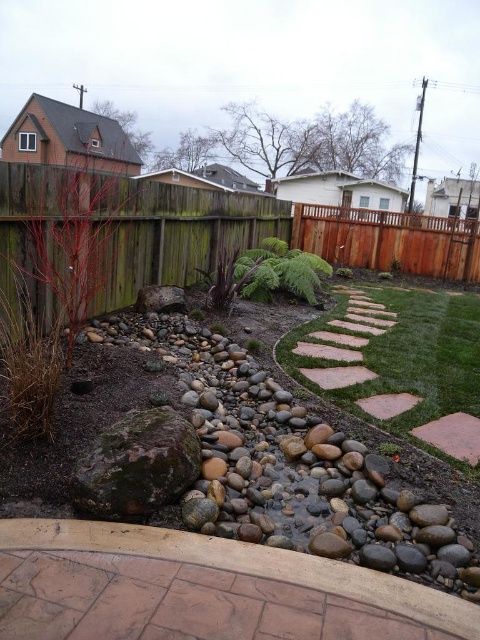
Can you confirm if green wood fence at left is smaller than green grass at center?

Incorrect, green wood fence at left is not smaller in size than green grass at center.

Is point (105, 186) closer to camera compared to point (456, 394)?

No, (105, 186) is further to viewer.

The width and height of the screenshot is (480, 640). Identify the location of green wood fence at left. (118, 234).

Is point (207, 221) closer to camera compared to point (434, 275)?

Yes, point (207, 221) is closer to viewer.

Between green wood fence at left and brown wood fence at upper right, which one appears on the right side from the viewer's perspective?

brown wood fence at upper right

Which is in front, point (244, 241) or point (367, 256)?

Point (244, 241) is in front.

Locate an element on the screen. The height and width of the screenshot is (640, 480). green wood fence at left is located at coordinates (118, 234).

Can you confirm if green grass at center is smaller than brown wood fence at upper right?

Incorrect, green grass at center is not smaller in size than brown wood fence at upper right.

Is green grass at center bigger than brown wood fence at upper right?

Yes, green grass at center is bigger than brown wood fence at upper right.

Describe the element at coordinates (406, 356) in the screenshot. I see `green grass at center` at that location.

This screenshot has height=640, width=480. Find the location of `green grass at center`. green grass at center is located at coordinates (406, 356).